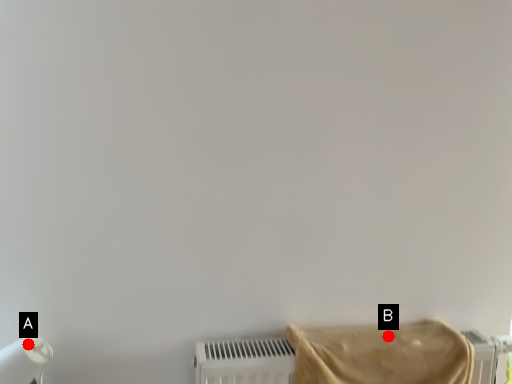
Question: Two points are circled on the image, labeled by A and B beside each circle. Which point is further to the camera?

Choices:
 (A) A is further
 (B) B is further

Answer: (B)